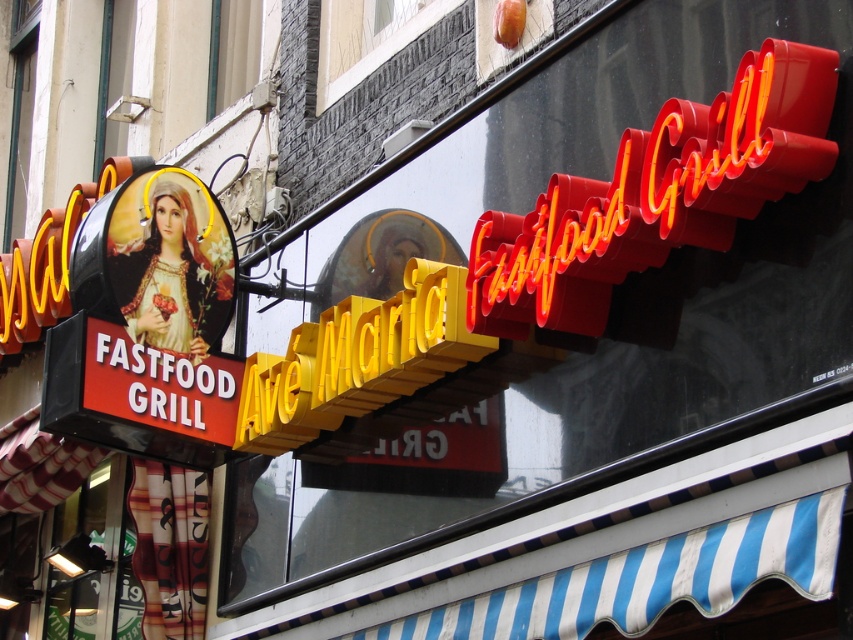
Question: Does neon red sign at upper right appear over yellow metallic sign at center?

Choices:
 (A) yes
 (B) no

Answer: (A)

Question: Does neon red sign at upper right appear on the right side of yellow metallic sign at center?

Choices:
 (A) no
 (B) yes

Answer: (B)

Question: Which point is farther to the camera?

Choices:
 (A) (669, 120)
 (B) (430, 369)

Answer: (B)

Question: Is neon red sign at upper right to the left of yellow metallic sign at center from the viewer's perspective?

Choices:
 (A) yes
 (B) no

Answer: (B)

Question: Which object is farther from the camera taking this photo?

Choices:
 (A) yellow metallic sign at center
 (B) neon red sign at upper right

Answer: (A)